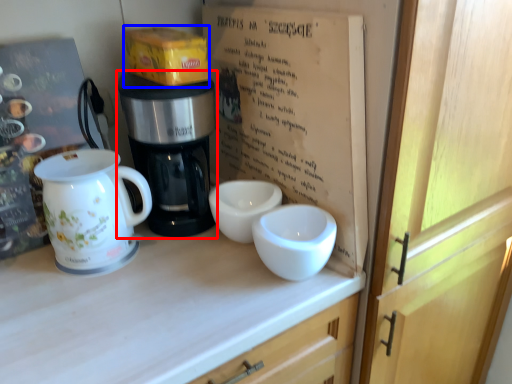
Question: Which of the following is the closest to the observer, coffee maker (highlighted by a red box) or cardboard box (highlighted by a blue box)?

Choices:
 (A) coffee maker
 (B) cardboard box

Answer: (A)